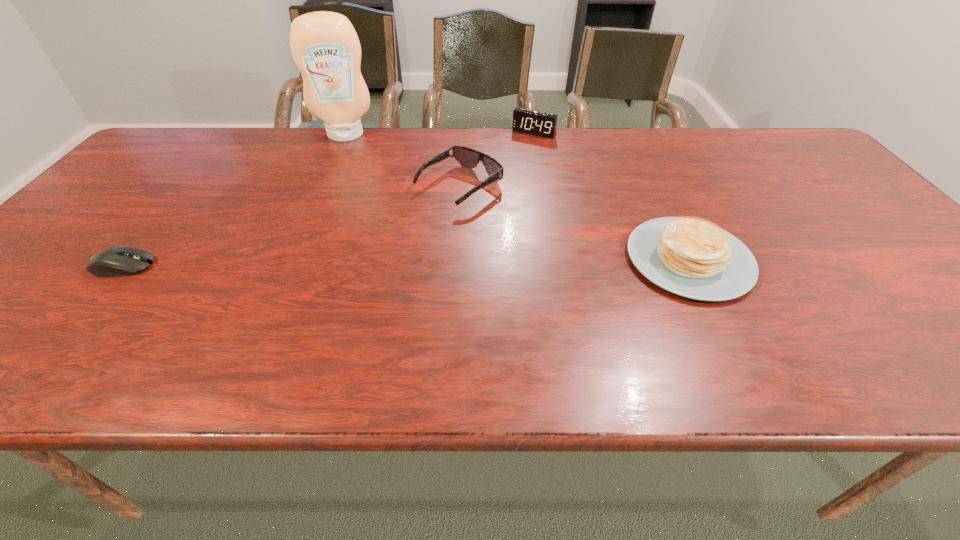
Identify the location of vacant position in the image that satisfies the following two spatial constraints: 1. on the front side of the sunglasses; 2. on the left side of the pancake. Image resolution: width=960 pixels, height=540 pixels. (455, 259).

I want to click on free space that satisfies the following two spatial constraints: 1. on the front side of the third nearest object; 2. on the left side of the pancake, so click(455, 259).